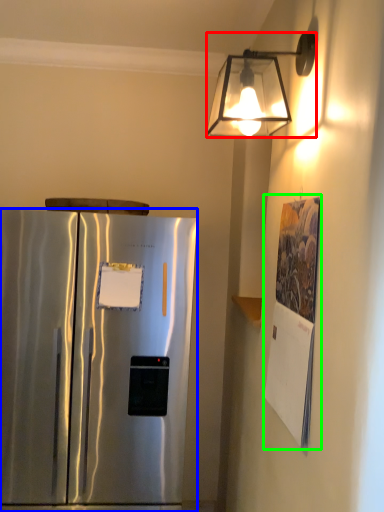
Question: Based on their relative distances, which object is farther from lamp (highlighted by a red box)? Choose from refrigerator (highlighted by a blue box) and poster (highlighted by a green box).

Choices:
 (A) refrigerator
 (B) poster

Answer: (A)